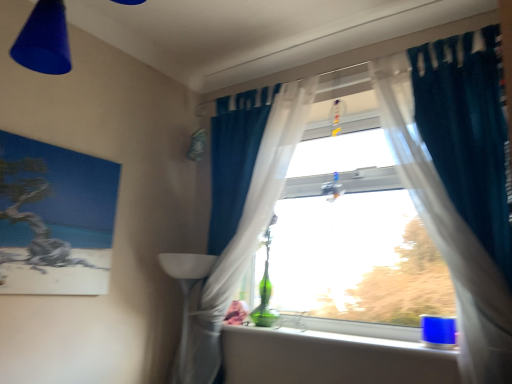
Question: Is matte canvas painting at left positioned beyond the bounds of teal fabric curtain at upper right, marked as the second curtain in a left-to-right arrangement?

Choices:
 (A) no
 (B) yes

Answer: (B)

Question: Considering the relative positions of matte canvas painting at left and teal fabric curtain at upper right, marked as the first curtain in a right-to-left arrangement, in the image provided, is matte canvas painting at left to the right of teal fabric curtain at upper right, marked as the first curtain in a right-to-left arrangement, from the viewer's perspective?

Choices:
 (A) no
 (B) yes

Answer: (A)

Question: From a real-world perspective, is matte canvas painting at left physically above teal fabric curtain at upper right, marked as the second curtain in a left-to-right arrangement?

Choices:
 (A) no
 (B) yes

Answer: (A)

Question: From a real-world perspective, is matte canvas painting at left under teal fabric curtain at upper right, marked as the second curtain in a left-to-right arrangement?

Choices:
 (A) yes
 (B) no

Answer: (A)

Question: Can you confirm if matte canvas painting at left is smaller than teal fabric curtain at upper right, marked as the first curtain in a right-to-left arrangement?

Choices:
 (A) no
 (B) yes

Answer: (B)

Question: Is point [x=84, y=195] positioned closer to the camera than point [x=224, y=253]?

Choices:
 (A) closer
 (B) farther

Answer: (A)

Question: From the image's perspective, relative to translucent fabric curtain at center, the second curtain from the right, is matte canvas painting at left above or below?

Choices:
 (A) above
 (B) below

Answer: (A)

Question: From a real-world perspective, is matte canvas painting at left positioned above or below translucent fabric curtain at center, the second curtain from the right?

Choices:
 (A) below
 (B) above

Answer: (A)

Question: Is matte canvas painting at left in front of or behind translucent fabric curtain at center, the 1th curtain in the left-to-right sequence, in the image?

Choices:
 (A) front
 (B) behind

Answer: (A)

Question: Would you say teal fabric curtain at upper right, marked as the second curtain in a left-to-right arrangement, is inside or outside matte plastic cone at upper left?

Choices:
 (A) inside
 (B) outside

Answer: (B)

Question: From their relative heights in the image, would you say teal fabric curtain at upper right, marked as the second curtain in a left-to-right arrangement, is taller or shorter than matte plastic cone at upper left?

Choices:
 (A) short
 (B) tall

Answer: (B)

Question: From the image's perspective, is teal fabric curtain at upper right, marked as the first curtain in a right-to-left arrangement, located above or below matte plastic cone at upper left?

Choices:
 (A) above
 (B) below

Answer: (B)

Question: Considering their positions, is teal fabric curtain at upper right, marked as the second curtain in a left-to-right arrangement, located in front of or behind matte plastic cone at upper left?

Choices:
 (A) front
 (B) behind

Answer: (B)

Question: Based on their positions, is blue plastic cup at lower right located to the left or right of teal fabric curtain at upper right, marked as the first curtain in a right-to-left arrangement?

Choices:
 (A) right
 (B) left

Answer: (B)

Question: From the image's perspective, is blue plastic cup at lower right above or below teal fabric curtain at upper right, marked as the first curtain in a right-to-left arrangement?

Choices:
 (A) below
 (B) above

Answer: (A)